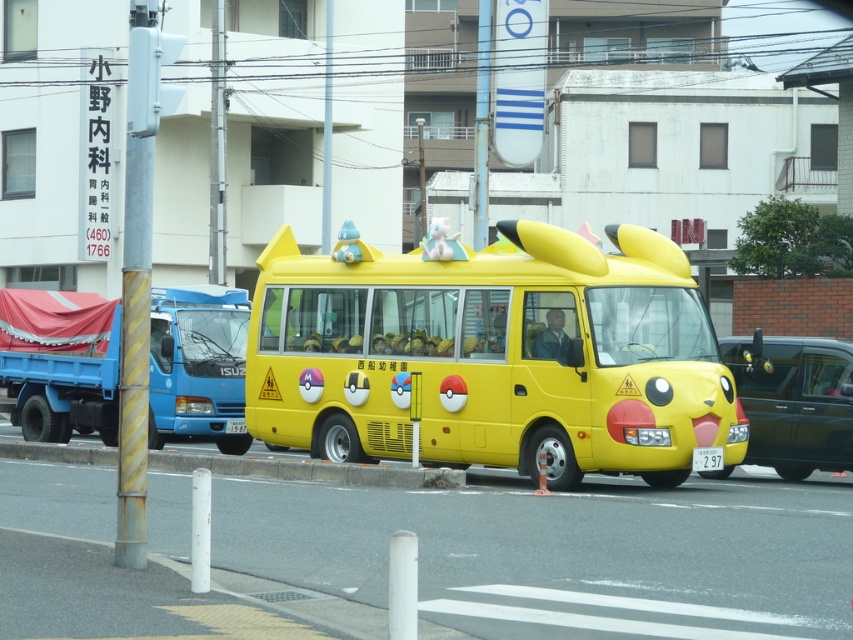
You are a pedestrian standing on the sidewalk. You see the yellow matte school bus at center and the shiny black car at right. Which vehicle is closer to the ground?

The yellow matte school bus at center is closer to the ground because it is positioned below the shiny black car at right.

You are a tourist in Japan and see this Pikachu themed bus. There is a shiny black car at right and a white plastic license plate at center. Which object is closer to the right side of the image?

The shiny black car at right is closer to the right side of the image because it is positioned to the right of the white plastic license plate at center.

Based on the photo, you are standing at a crosswalk and see the yellow matte school bus at center parked on the street. You want to take a photo of it with your smartphone camera. Considering the distance between you and the bus, will you be able to capture the entire bus in a single frame without zooming in? Please explain your reasoning.

The yellow matte school bus at center and the camera are 66.35 feet apart. A typical smartphone camera has a field of view of around 67 degrees. At 66.35 feet away, the bus would need to be within the camera sensor and lens combination. However, the exact dimensions of the bus are not provided. If the bus is standard school bus length, which is about 35 feet long, then the angular size would be roughly 35 feet divided by 66.35 feet, which is about 0.528 radians. Converting to degrees, 0.528 radians is about